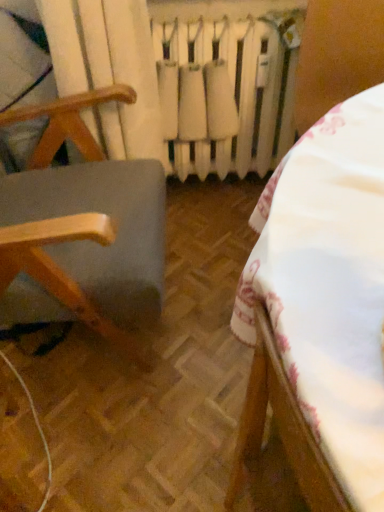
Question: Which is correct: white fabric tablecloth at center, the second furniture viewed from the left, is inside wooden chair at left, acting as the 2th furniture starting from the right, or outside of it?

Choices:
 (A) outside
 (B) inside

Answer: (A)

Question: From a real-world perspective, is white fabric tablecloth at center, the first furniture viewed from the right, positioned above or below wooden chair at left, acting as the 2th furniture starting from the right?

Choices:
 (A) above
 (B) below

Answer: (B)

Question: Estimate the real-world distances between objects in this image. Which object is farther from the white fabric tablecloth at center, the first furniture viewed from the right?

Choices:
 (A) wooden chair at left, positioned as the first furniture in left-to-right order
 (B) white matte radiator at center

Answer: (B)

Question: Estimate the real-world distances between objects in this image. Which object is farther from the wooden chair at left, acting as the 2th furniture starting from the right?

Choices:
 (A) white matte radiator at center
 (B) white fabric tablecloth at center, the first furniture viewed from the right

Answer: (B)